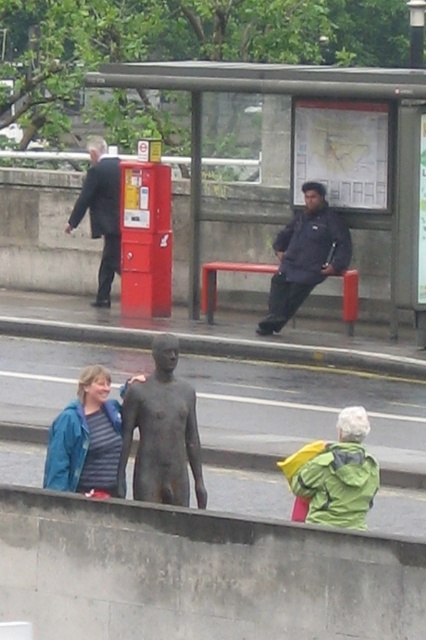
Question: Which of the following is the farthest from the observer?

Choices:
 (A) (276, 220)
 (B) (51, 483)

Answer: (A)

Question: Is matte blue jacket at lower left closer to the viewer compared to dark blue jacket at center?

Choices:
 (A) no
 (B) yes

Answer: (B)

Question: Among these points, which one is nearest to the camera?

Choices:
 (A) (317, 280)
 (B) (170, 493)
 (C) (118, 86)

Answer: (B)

Question: Can you confirm if metallic red bench at center is smaller than matte blue jacket at lower left?

Choices:
 (A) yes
 (B) no

Answer: (B)

Question: Does bronze statue at center have a smaller size compared to matte blue jacket at lower left?

Choices:
 (A) yes
 (B) no

Answer: (A)

Question: Which is farther from the bronze statue at center?

Choices:
 (A) dark blue jacket at center
 (B) dark suit at left

Answer: (B)